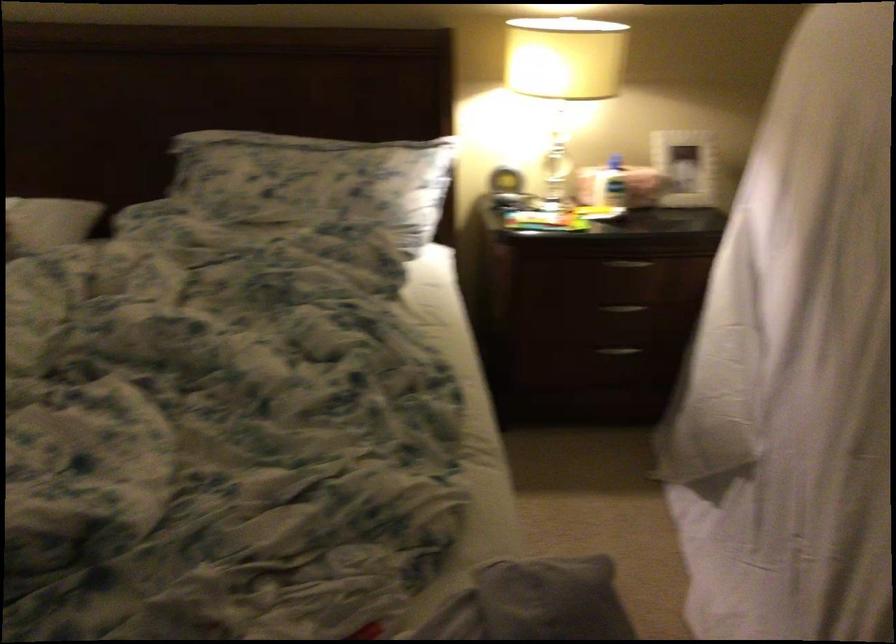
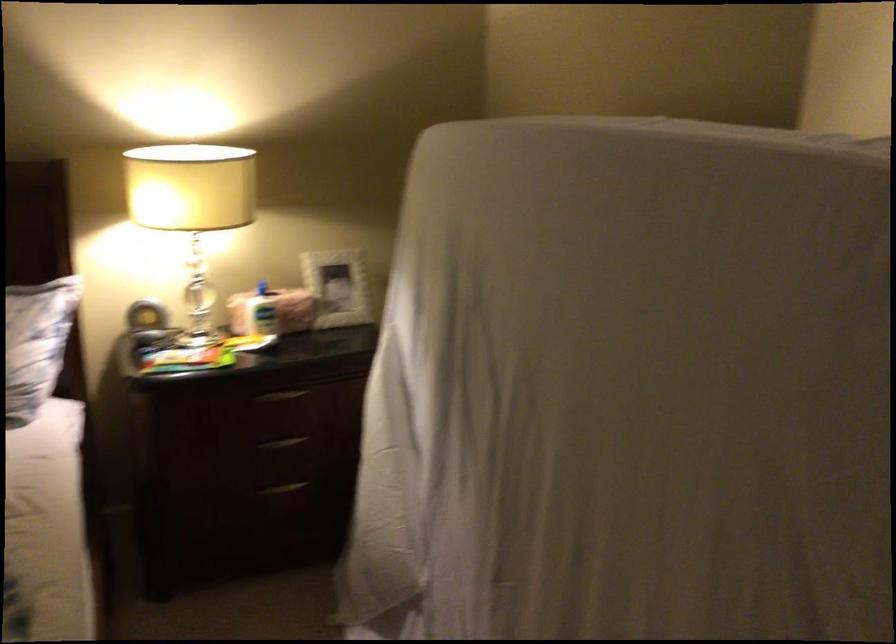
Where in the second image is the point corresponding to point 630,259 from the first image?

(280, 395)